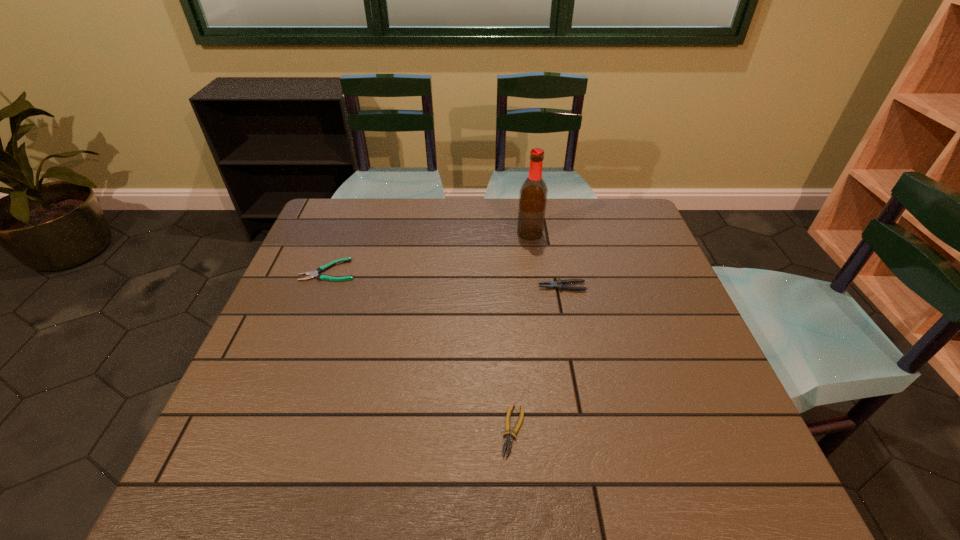
Where is `vacant space at the far left corner`? vacant space at the far left corner is located at coordinates (324, 238).

Find the location of a particular element. This screenshot has height=540, width=960. vacant area at the far right corner is located at coordinates (611, 221).

This screenshot has width=960, height=540. I want to click on vacant area between the rightmost pliers and the leftmost pliers, so click(x=445, y=279).

Identify the location of empty space between the tallest pliers and the leftmost pliers. (445, 279).

You are a GUI agent. You are given a task and a screenshot of the screen. Output one action in this format:
    pyautogui.click(x=<x>, y=<y>)
    Task: Click on the unoccupied position between the farthest object and the rightmost pliers
    
    Given the screenshot: What is the action you would take?
    pyautogui.click(x=546, y=260)

Locate an element on the screen. The image size is (960, 540). unoccupied area between the farthest object and the second pliers from left to right is located at coordinates (521, 332).

Where is `vacant point located between the third object from right to left and the tallest object`? vacant point located between the third object from right to left and the tallest object is located at coordinates (521, 332).

Identify the location of vacant space in between the leftmost pliers and the beer bottle. The image size is (960, 540). (429, 252).

Identify the location of vacant region between the third shortest object and the leftmost pliers. (445, 279).

Where is `free space between the second pliers from left to right and the leftmost object`? This screenshot has height=540, width=960. free space between the second pliers from left to right and the leftmost object is located at coordinates (421, 350).